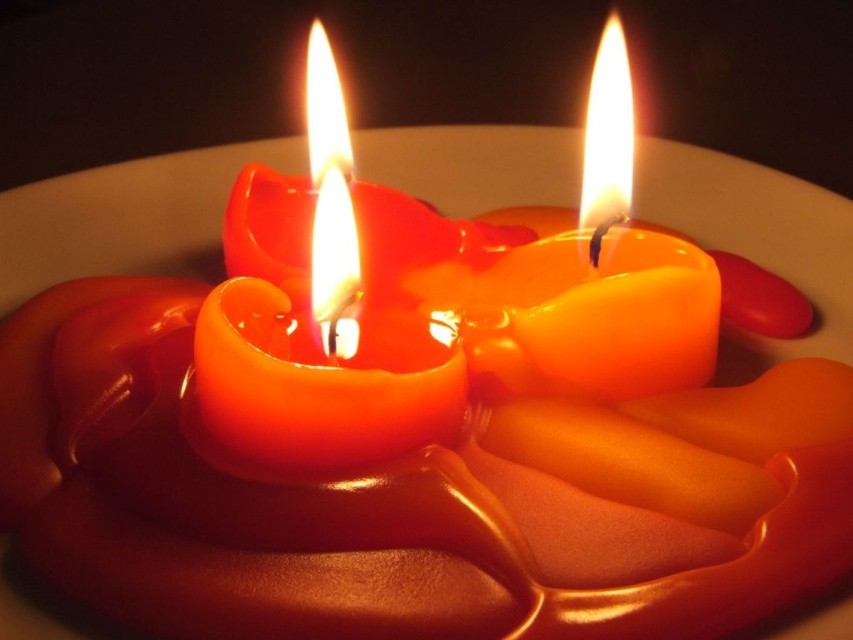
Can you confirm if glossy wax candle at center is positioned below orange glossy candle at center?

Correct, glossy wax candle at center is located below orange glossy candle at center.

Where is `glossy wax candle at center`? This screenshot has height=640, width=853. glossy wax candle at center is located at coordinates (323, 336).

Which is behind, point (227, 344) or point (633, 300)?

The point (633, 300) is behind.

At what (x,y) coordinates should I click in order to perform the action: click on glossy wax candle at center. Please return your answer as a coordinate pair (x, y). The width and height of the screenshot is (853, 640). Looking at the image, I should click on (323, 336).